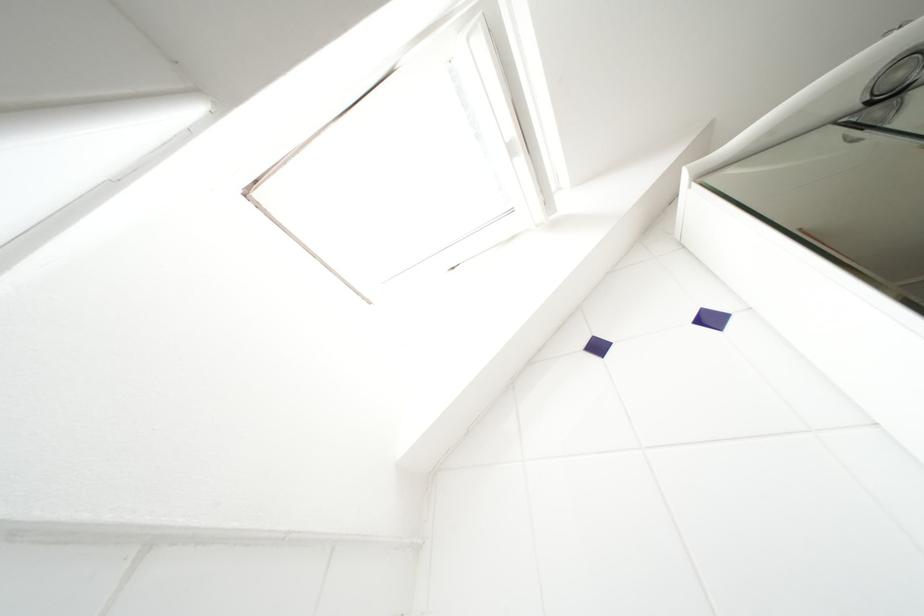
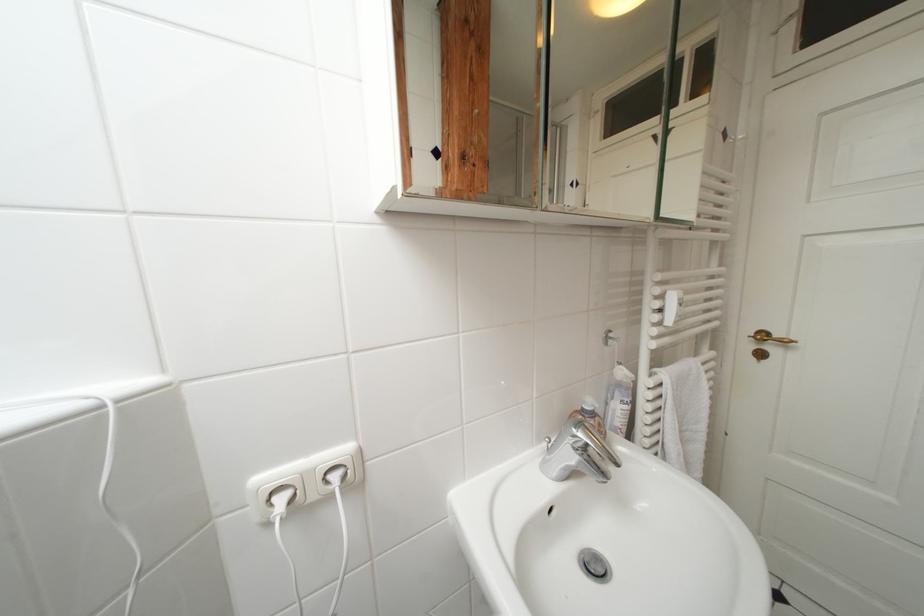
Based on the continuous images, in which direction is the camera rotating?

The camera rotated toward right-down.